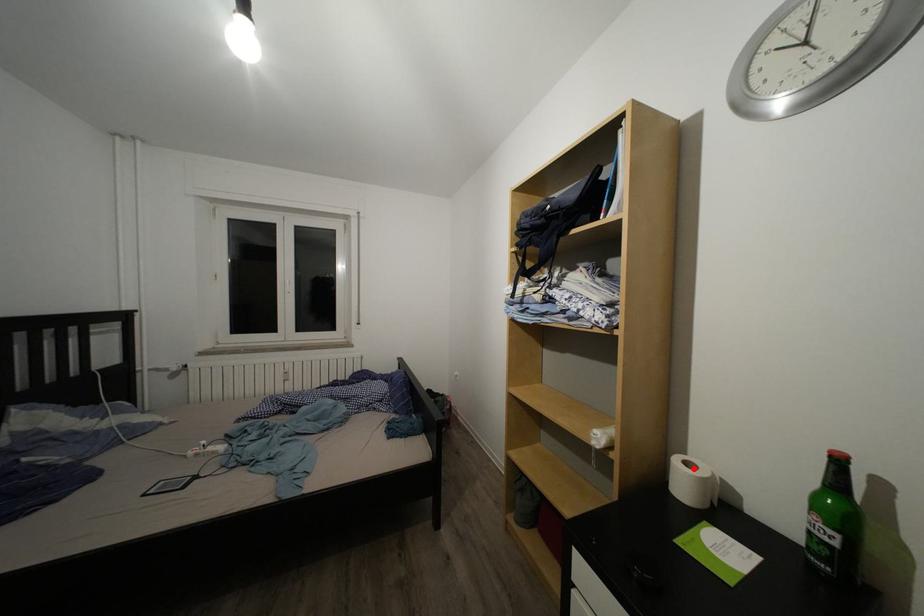
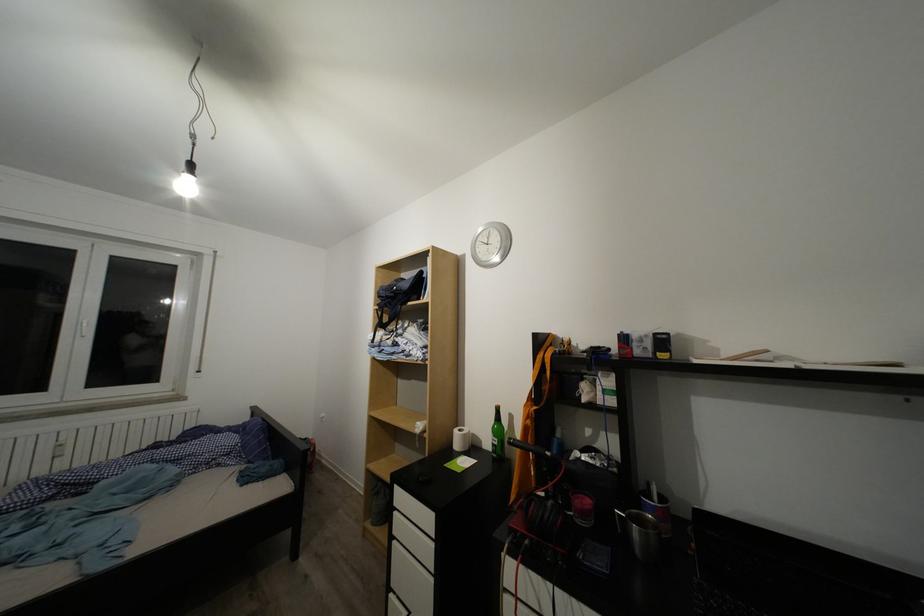
Question: I am providing you with two images of the same scene from different viewpoints. Image1 has a red point marked. In image2, the corresponding 3D location appears at what relative position? Reply with the corresponding letter.

Choices:
 (A) Closer
 (B) Farther

Answer: (B)